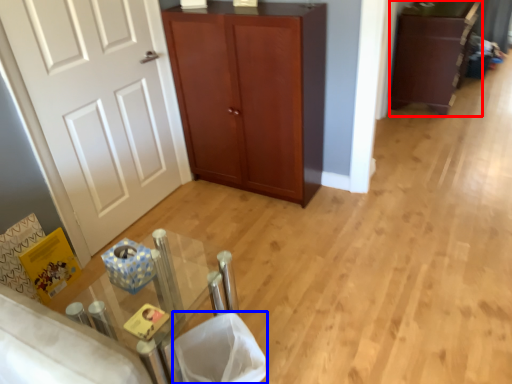
Question: Which object appears closest to the camera in this image, cabinetry (highlighted by a red box) or laundry basket (highlighted by a blue box)?

Choices:
 (A) cabinetry
 (B) laundry basket

Answer: (B)